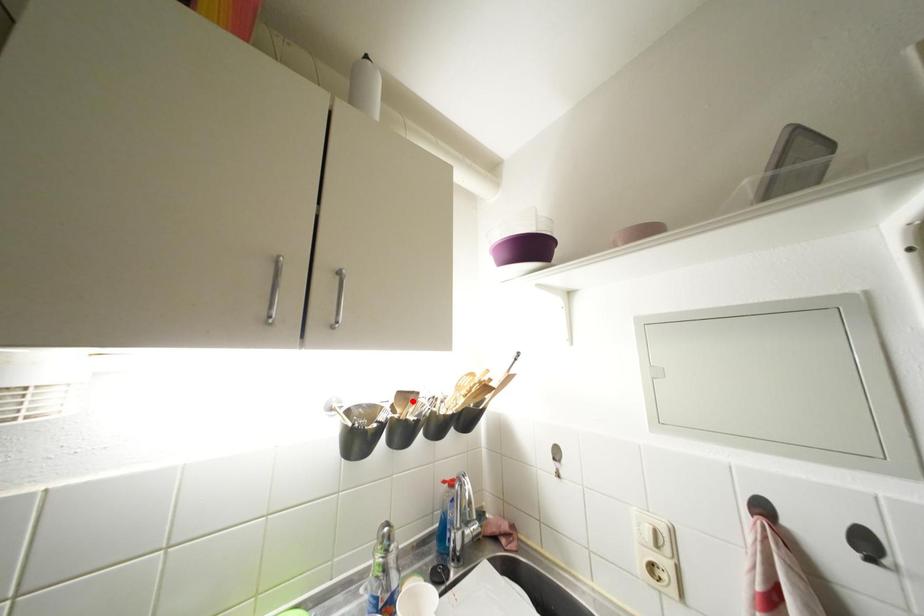
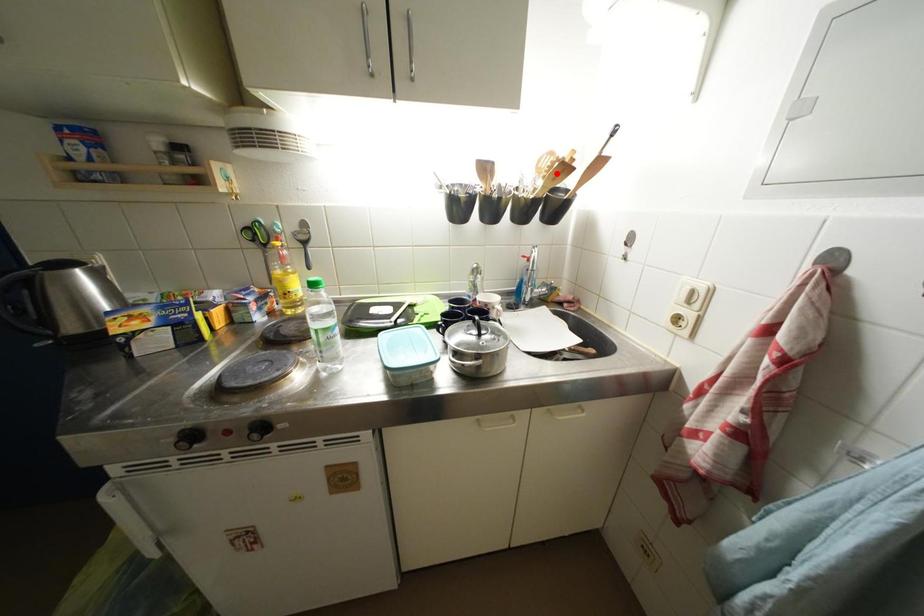
I am providing you with two images of the same scene from different viewpoints. A red point is marked on the first image and another point is marked on the second image. Are the points marked in image1 and image2 representing the same 3D position?

No